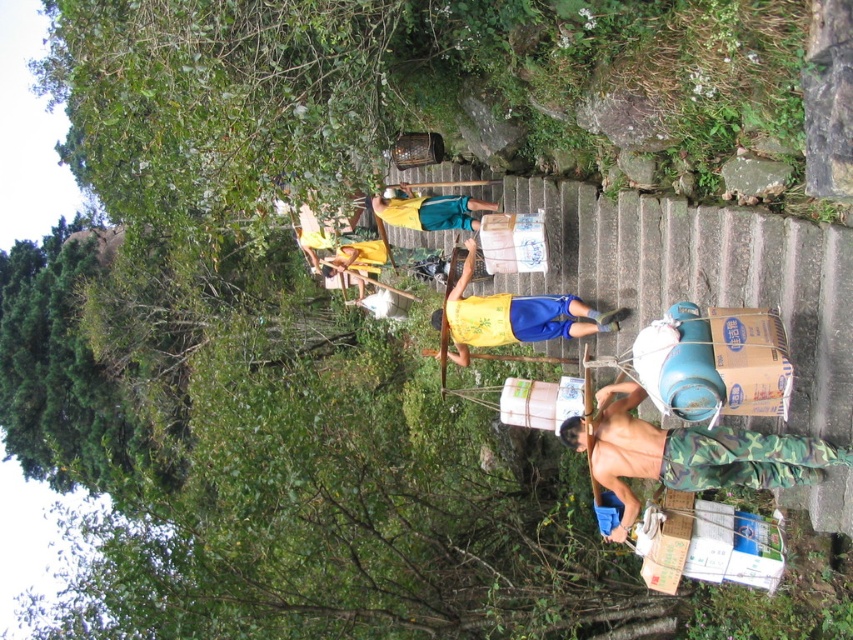
You are a photographer trying to capture a photo of the camouflage pants at lower right and the yellow fabric shirt at center. Which one is closer to the camera?

The camouflage pants at lower right is closer to the camera because it is in front of the yellow fabric shirt at center.

You are a photographer trying to capture a group photo of the camouflage pants at lower right and the yellow fabric shirt at upper center. Which subject should you focus on first to ensure they are both in frame?

The camouflage pants at lower right is below the yellow fabric shirt at upper center, so you should focus on the yellow fabric shirt at upper center first to ensure both are in frame.